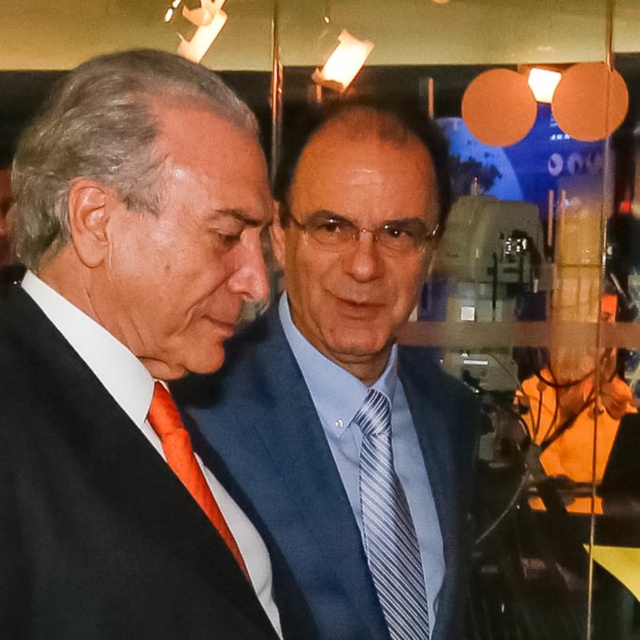
You are a photographer at a space conference and need to adjust your camera focus. You notice the blue striped tie at center and the orange silk tie at left. Which tie is positioned lower in the image?

The blue striped tie at center is below the orange silk tie at left, so the blue striped tie at center is positioned lower in the image.

You are a photographer at a space conference. You need to take a photo of the blue satin suit at center and the orange silk tie at left. Which object is closer to the camera?

The blue satin suit at center is closer to the camera than the orange silk tie at left because it is further to the viewer according to the description.